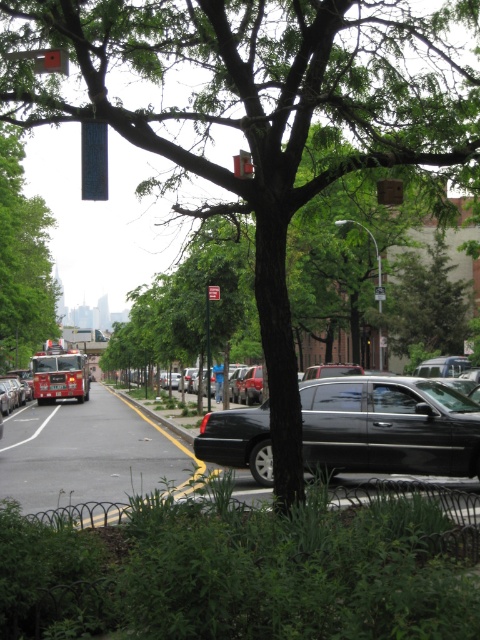
Between green leafy tree at center and brushed metal fire truck at left, which one appears on the left side from the viewer's perspective?

green leafy tree at center is more to the left.

Which is in front, point (19, 150) or point (37, 394)?

Positioned in front is point (19, 150).

Measure the distance between green leafy tree at center and camera.

They are 32.33 meters apart.

You are a GUI agent. You are given a task and a screenshot of the screen. Output one action in this format:
    pyautogui.click(x=<x>, y=<y>)
    Task: Click on the green leafy tree at center
    The width and height of the screenshot is (480, 640).
    Given the screenshot: What is the action you would take?
    pyautogui.click(x=23, y=260)

At what (x,y) coordinates should I click in order to perform the action: click on brushed metal fire truck at left. Please return your answer as a coordinate pair (x, y). Looking at the image, I should click on click(x=60, y=372).

Is brushed metal fire truck at left thinner than metallic rectangular at upper center?

In fact, brushed metal fire truck at left might be wider than metallic rectangular at upper center.

Does point (48, 372) come farther from viewer compared to point (245, 176)?

That is True.

Where is `brushed metal fire truck at left`? brushed metal fire truck at left is located at coordinates (60, 372).

Does glossy black sedan at center have a greater height compared to green leafy tree at center?

In fact, glossy black sedan at center may be shorter than green leafy tree at center.

Can you confirm if glossy black sedan at center is positioned above green leafy tree at center?

No, glossy black sedan at center is not above green leafy tree at center.

I want to click on glossy black sedan at center, so click(x=388, y=426).

Where is `glossy black sedan at center`? Image resolution: width=480 pixels, height=640 pixels. glossy black sedan at center is located at coordinates (388, 426).